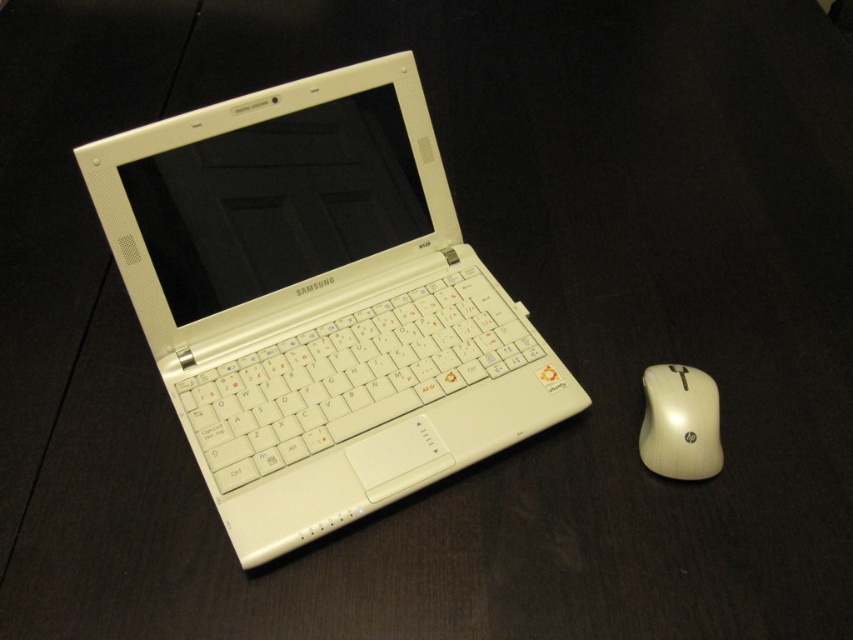
Looking at this image, is white plastic laptop at center bigger than white plastic mouse at right?

Yes.

Is white plastic laptop at center shorter than white plastic mouse at right?

No, white plastic laptop at center is not shorter than white plastic mouse at right.

I want to click on white plastic laptop at center, so click(318, 301).

Identify the location of white plastic laptop at center. (318, 301).

Who is taller, white plastic laptop at center or white matte keyboard at center?

white plastic laptop at center

Where is `white plastic laptop at center`? white plastic laptop at center is located at coordinates (318, 301).

In the scene shown: Does white matte keyboard at center have a lesser height compared to white plastic mouse at right?

In fact, white matte keyboard at center may be taller than white plastic mouse at right.

Who is shorter, white matte keyboard at center or white plastic mouse at right?

Standing shorter between the two is white plastic mouse at right.

Identify the location of white matte keyboard at center. The image size is (853, 640). (351, 374).